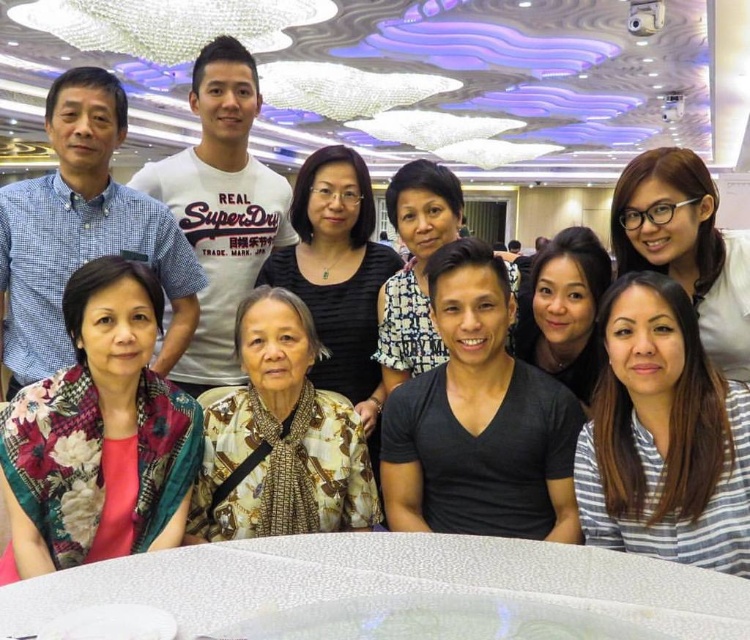
Question: Which object is positioned closest to the white textured table at center?

Choices:
 (A) floral fabric shawl at lower left
 (B) white cotton t-shirt at upper center
 (C) floral-patterned blouse at lower left
 (D) printed fabric blouse at center

Answer: (D)

Question: Which point is closer to the camera?

Choices:
 (A) (116, 576)
 (B) (146, 204)
 (C) (288, 470)
 (D) (324, 182)

Answer: (A)

Question: In this image, where is striped cotton shirt at lower right located relative to floral-patterned blouse at lower left?

Choices:
 (A) above
 (B) below

Answer: (B)

Question: Is white textured table at center to the right of floral fabric shawl at lower left from the viewer's perspective?

Choices:
 (A) no
 (B) yes

Answer: (B)

Question: Among these objects, which one is nearest to the camera?

Choices:
 (A) floral-patterned blouse at lower left
 (B) floral fabric shawl at lower left

Answer: (B)

Question: Does floral fabric shawl at lower left have a greater width compared to printed fabric blouse at center?

Choices:
 (A) yes
 (B) no

Answer: (B)